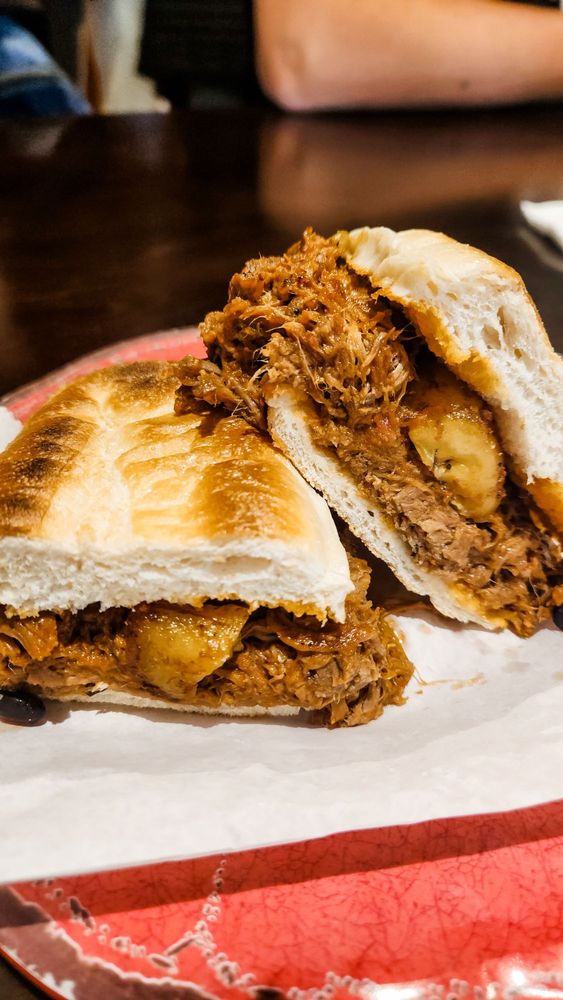
You are a GUI agent. You are given a task and a screenshot of the screen. Output one action in this format:
    pyautogui.click(x=<x>, y=<y>)
    Task: Click on the table
    This screenshot has width=563, height=1000.
    Given the screenshot: What is the action you would take?
    pyautogui.click(x=144, y=221)